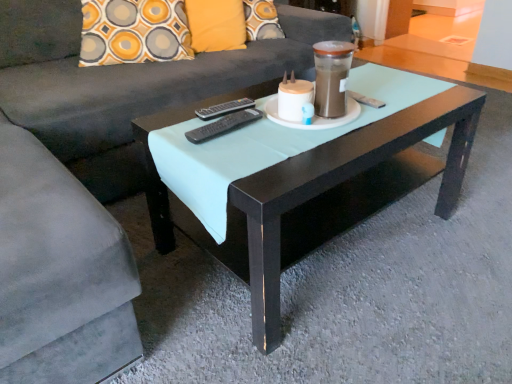
Locate an element on the screen. The height and width of the screenshot is (384, 512). free location in front of transparent glass beverage at center is located at coordinates (330, 140).